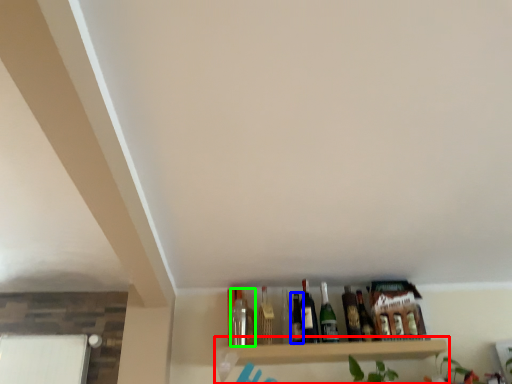
Question: Based on their relative distances, which object is farther from shelf (highlighted by a red box)? Choose from bottle (highlighted by a blue box) and bottle (highlighted by a green box).

Choices:
 (A) bottle
 (B) bottle

Answer: (B)